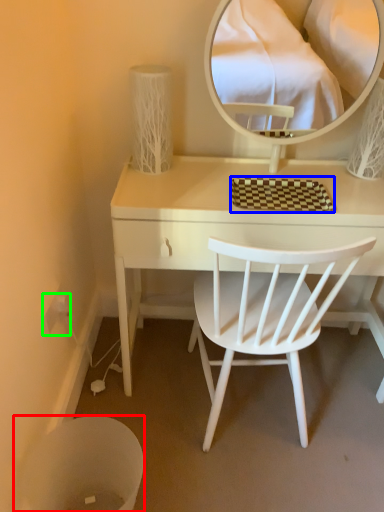
Question: Estimate the real-world distances between objects in this image. Which object is closer to trash bin/can (highlighted by a red box), mat (highlighted by a blue box) or power outlet (highlighted by a green box)?

Choices:
 (A) mat
 (B) power outlet

Answer: (B)